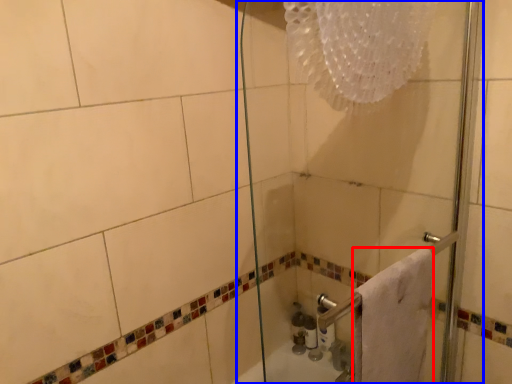
Question: Which object is further to the camera taking this photo, towel (highlighted by a red box) or shower door (highlighted by a blue box)?

Choices:
 (A) towel
 (B) shower door

Answer: (A)